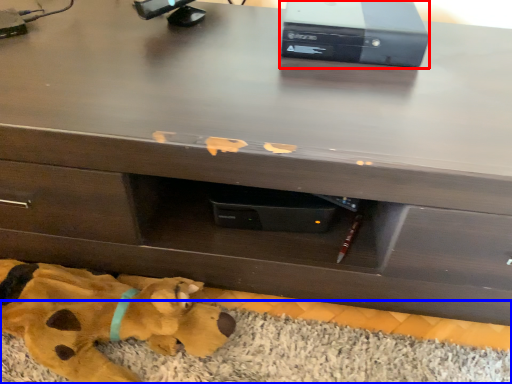
Question: Which of the following is the closest to the observer, computer (highlighted by a red box) or mat (highlighted by a blue box)?

Choices:
 (A) computer
 (B) mat

Answer: (B)